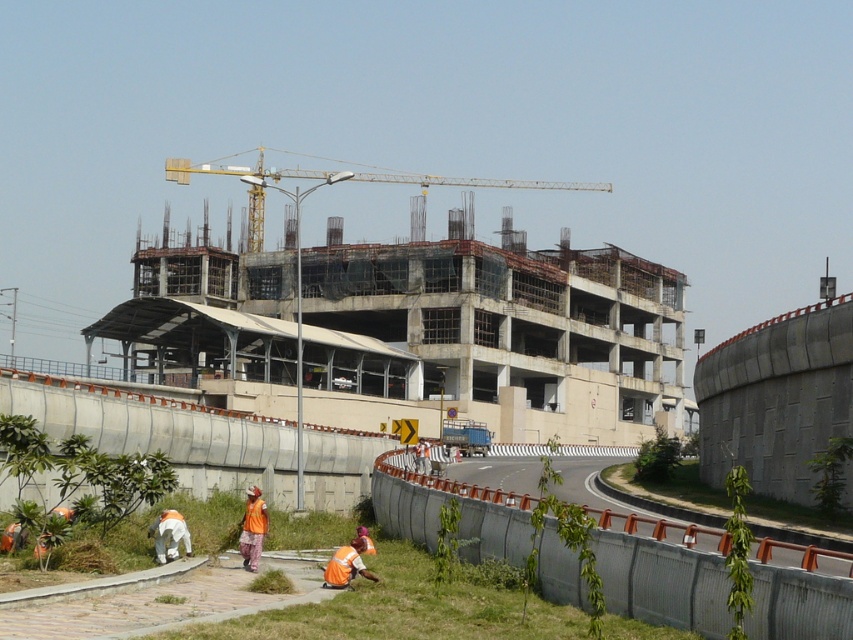
Looking at this image, you are a construction worker standing at the point with coordinates (364, 177). What object are you standing on?

The point (364, 177) corresponds to the yellow metallic crane at upper center, so you are standing on the yellow metallic crane at upper center.

You are a construction supervisor assessing the layout of the site. You need to ensure that the yellow metallic crane at upper center can rotate freely without hitting the orange fabric at lower center. Based on their widths, which object is wider and might pose a collision risk if not positioned correctly?

The yellow metallic crane at upper center is wider than the orange fabric at lower center, so it might pose a collision risk if not positioned correctly.

You are a safety inspector at the construction site. You notice two fabrics, the orange fabric at lower center and the white fabric at lower left. Which fabric is taller?

The orange fabric at lower center is much taller than the white fabric at lower left.